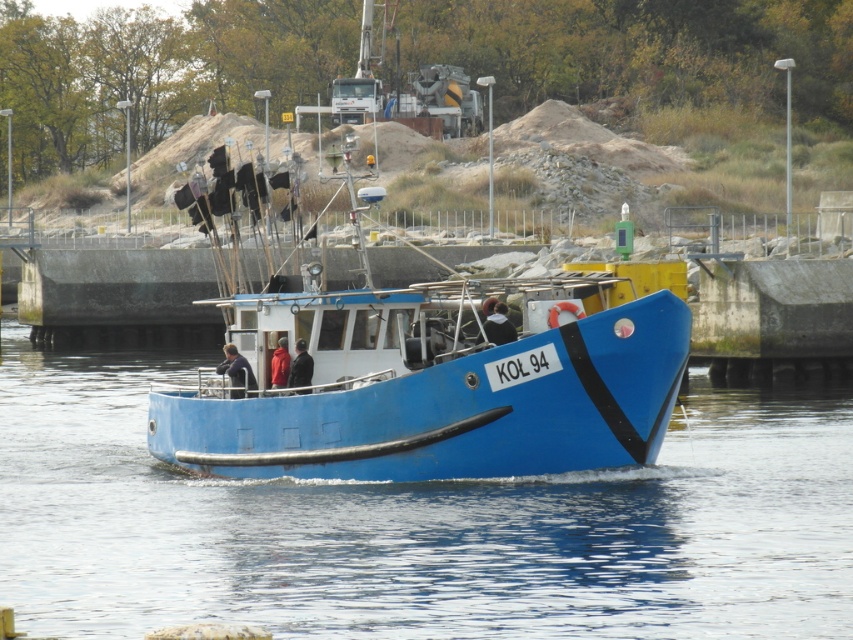
Question: Can you confirm if blue rubber boat at center is positioned to the left of blue matte boat at center?

Choices:
 (A) yes
 (B) no

Answer: (A)

Question: Which of the following is the farthest from the observer?

Choices:
 (A) blue rubber boat at center
 (B) blue matte boat at center

Answer: (B)

Question: Is blue rubber boat at center positioned in front of blue matte boat at center?

Choices:
 (A) yes
 (B) no

Answer: (A)

Question: Can you confirm if blue rubber boat at center is smaller than blue matte boat at center?

Choices:
 (A) yes
 (B) no

Answer: (B)

Question: Which point appears farthest from the camera in this image?

Choices:
 (A) (511, 492)
 (B) (531, 381)

Answer: (A)